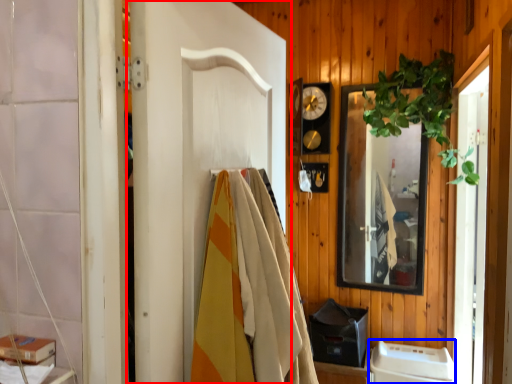
Question: Which object appears farthest to the camera in this image, door (highlighted by a red box) or appliance (highlighted by a blue box)?

Choices:
 (A) door
 (B) appliance

Answer: (B)